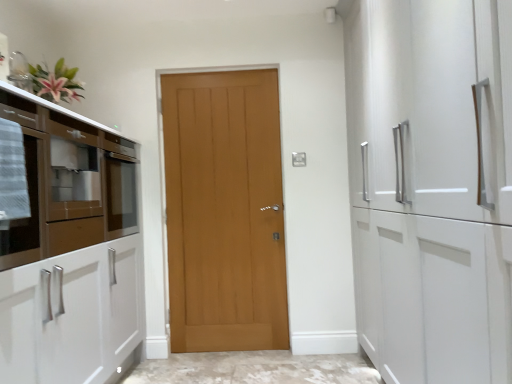
Where is `matte glass cabinet at left`? This screenshot has width=512, height=384. matte glass cabinet at left is located at coordinates (70, 250).

This screenshot has height=384, width=512. What do you see at coordinates (70, 250) in the screenshot? I see `matte glass cabinet at left` at bounding box center [70, 250].

What is the approximate width of matte glass cabinet at left?

It is 26.11 inches.

Find the location of a particular element. The height and width of the screenshot is (384, 512). light brown wood door at center is located at coordinates (225, 211).

The height and width of the screenshot is (384, 512). Describe the element at coordinates (225, 211) in the screenshot. I see `light brown wood door at center` at that location.

Identify the location of matte glass cabinet at left. This screenshot has height=384, width=512. (70, 250).

Is light brown wood door at center to the left of matte glass cabinet at left from the viewer's perspective?

In fact, light brown wood door at center is to the right of matte glass cabinet at left.

From the picture: Relative to matte glass cabinet at left, is light brown wood door at center in front or behind?

light brown wood door at center is behind matte glass cabinet at left.

Does point (239, 155) appear closer or farther from the camera than point (57, 193)?

Clearly, point (239, 155) is more distant from the camera than point (57, 193).

From the image's perspective, which is below, light brown wood door at center or matte glass cabinet at left?

light brown wood door at center.

From a real-world perspective, which is physically above, light brown wood door at center or matte glass cabinet at left?

matte glass cabinet at left is physically above.

Looking at their sizes, would you say light brown wood door at center is wider or thinner than matte glass cabinet at left?

In the image, light brown wood door at center appears to be more narrow than matte glass cabinet at left.

Considering the sizes of light brown wood door at center and matte glass cabinet at left in the image, is light brown wood door at center taller or shorter than matte glass cabinet at left?

In the image, light brown wood door at center appears to be taller than matte glass cabinet at left.

In the scene shown: Can you confirm if light brown wood door at center is bigger than matte glass cabinet at left?

Actually, light brown wood door at center might be smaller than matte glass cabinet at left.

Is light brown wood door at center inside or outside of matte glass cabinet at left?

light brown wood door at center is not enclosed by matte glass cabinet at left.

Is light brown wood door at center far from matte glass cabinet at left?

No, light brown wood door at center is in close proximity to matte glass cabinet at left.

Is light brown wood door at center positioned with its back to matte glass cabinet at left?

light brown wood door at center does not have its back to matte glass cabinet at left.

The image size is (512, 384). Identify the location of door below the matte glass cabinet at left (from a real-world perspective). (225, 211).

Based on the photo, is matte glass cabinet at left at the right side of light brown wood door at center?

In fact, matte glass cabinet at left is to the left of light brown wood door at center.

Consider the image. Which object is further away from the camera taking this photo, matte glass cabinet at left or light brown wood door at center?

light brown wood door at center is further from the camera.

Considering the points (17, 380) and (183, 146), which point is behind, point (17, 380) or point (183, 146)?

Positioned behind is point (183, 146).

From the image's perspective, which one is positioned lower, matte glass cabinet at left or light brown wood door at center?

From the image's view, light brown wood door at center is below.

Looking at this image, from a real-world perspective, does matte glass cabinet at left sit lower than light brown wood door at center?

Incorrect, from a real-world perspective, matte glass cabinet at left is higher than light brown wood door at center.

Considering the sizes of objects matte glass cabinet at left and light brown wood door at center in the image provided, who is wider, matte glass cabinet at left or light brown wood door at center?

With larger width is matte glass cabinet at left.

In terms of height, does matte glass cabinet at left look taller or shorter compared to light brown wood door at center?

matte glass cabinet at left is shorter than light brown wood door at center.

From the picture: Who is smaller, matte glass cabinet at left or light brown wood door at center?

light brown wood door at center.

Is matte glass cabinet at left located outside light brown wood door at center?

matte glass cabinet at left lies outside light brown wood door at center's area.

Is matte glass cabinet at left touching light brown wood door at center?

matte glass cabinet at left and light brown wood door at center are clearly separated.

Could you tell me if matte glass cabinet at left is turned towards light brown wood door at center?

Yes, matte glass cabinet at left is oriented towards light brown wood door at center.

Measure the distance between matte glass cabinet at left and light brown wood door at center.

matte glass cabinet at left and light brown wood door at center are 32.64 inches apart.

Where is `cabinetry positioned vertically above the light brown wood door at center (from a real-world perspective)`? The height and width of the screenshot is (384, 512). cabinetry positioned vertically above the light brown wood door at center (from a real-world perspective) is located at coordinates (70, 250).

At what (x,y) coordinates should I click in order to perform the action: click on cabinetry above the light brown wood door at center (from a real-world perspective). Please return your answer as a coordinate pair (x, y). This screenshot has width=512, height=384. Looking at the image, I should click on coord(70,250).

Identify the location of cabinetry on the left of the light brown wood door at center. The height and width of the screenshot is (384, 512). (70, 250).